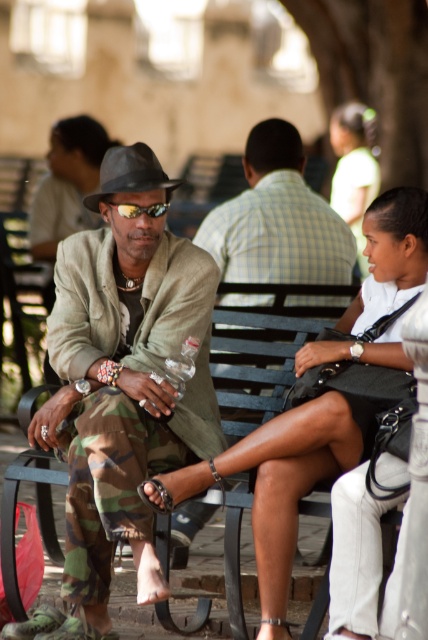
Question: Can you confirm if matte black bag at center is smaller than checkered fabric shirt at center?

Choices:
 (A) no
 (B) yes

Answer: (B)

Question: Among these objects, which one is nearest to the camera?

Choices:
 (A) matte black bag at center
 (B) matte black dress at center
 (C) checkered fabric shirt at center

Answer: (A)

Question: Is camouflage pants at center wider than yellow reflective lenses at center?

Choices:
 (A) no
 (B) yes

Answer: (B)

Question: Does camouflage pants at center have a larger size compared to matte black dress at center?

Choices:
 (A) no
 (B) yes

Answer: (A)

Question: Which object is the closest to the matte black dress at center?

Choices:
 (A) checkered fabric shirt at center
 (B) camouflage pants at center
 (C) matte black bag at center
 (D) yellow reflective lenses at center

Answer: (A)

Question: Which point is closer to the camera?

Choices:
 (A) checkered fabric shirt at center
 (B) yellow reflective lenses at center
 (C) camouflage pants at center

Answer: (C)